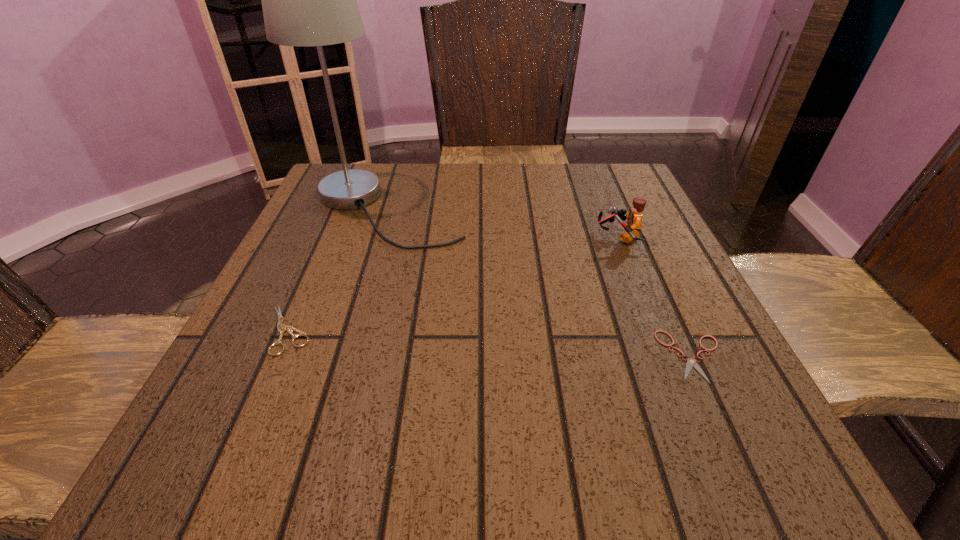
This screenshot has width=960, height=540. Identify the location of blank space at the left edge of the desktop. (289, 275).

Find the location of `vacant space at the right edge of the desktop`. vacant space at the right edge of the desktop is located at coordinates (721, 372).

Image resolution: width=960 pixels, height=540 pixels. In order to click on free space at the far left corner of the desktop in this screenshot , I will do `click(328, 210)`.

This screenshot has height=540, width=960. In order to click on free space at the near left corner of the desktop in this screenshot , I will do `click(252, 484)`.

This screenshot has height=540, width=960. Find the location of `free space at the far right corner of the desktop`. free space at the far right corner of the desktop is located at coordinates tap(583, 181).

The width and height of the screenshot is (960, 540). Find the location of `vacant point located between the tallest object and the left shears`. vacant point located between the tallest object and the left shears is located at coordinates (337, 269).

The image size is (960, 540). I want to click on vacant area that lies between the shorter shears and the second tallest object, so click(x=656, y=297).

The image size is (960, 540). In order to click on free point between the Lego and the third tallest object in this screenshot , I will do [x=453, y=284].

Find the location of a particular element. vacant space in between the Lego and the table lamp is located at coordinates (502, 223).

At what (x,y) coordinates should I click in order to perform the action: click on free spot between the right shears and the second tallest object. Please return your answer as a coordinate pair (x, y). Looking at the image, I should click on (656, 297).